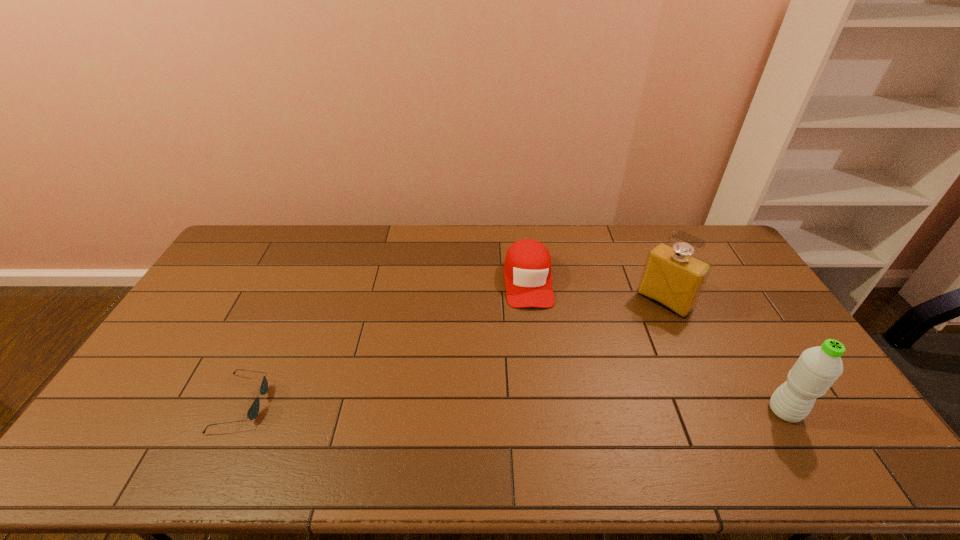
Locate an element on the screen. free location located 0.340m on the front-facing side of the baseball cap is located at coordinates (541, 400).

You are a GUI agent. You are given a task and a screenshot of the screen. Output one action in this format:
    pyautogui.click(x=<x>, y=<y>)
    Task: Click on the vacant space located 0.400m on the front-facing side of the perfume
    
    Given the screenshot: What is the action you would take?
    click(x=577, y=388)

Image resolution: width=960 pixels, height=540 pixels. I want to click on vacant space located 0.180m on the front-facing side of the perfume, so click(x=621, y=345).

You are a GUI agent. You are given a task and a screenshot of the screen. Output one action in this format:
    pyautogui.click(x=<x>, y=<y>)
    Task: Click on the free space located on the front-facing side of the perfume
    
    Given the screenshot: What is the action you would take?
    pyautogui.click(x=596, y=369)

Where is `object that is positioned at the far edge`? This screenshot has width=960, height=540. object that is positioned at the far edge is located at coordinates (527, 271).

I want to click on sunglasses at the near edge, so click(253, 411).

Where is `water bottle located at the near edge`? Image resolution: width=960 pixels, height=540 pixels. water bottle located at the near edge is located at coordinates (816, 370).

Locate an element on the screen. The width and height of the screenshot is (960, 540). object situated at the right edge is located at coordinates point(816,370).

The width and height of the screenshot is (960, 540). In order to click on object located at the near right corner in this screenshot , I will do `click(816, 370)`.

This screenshot has height=540, width=960. In the image, there is a desktop. Identify the location of vacant space at the far edge. (451, 262).